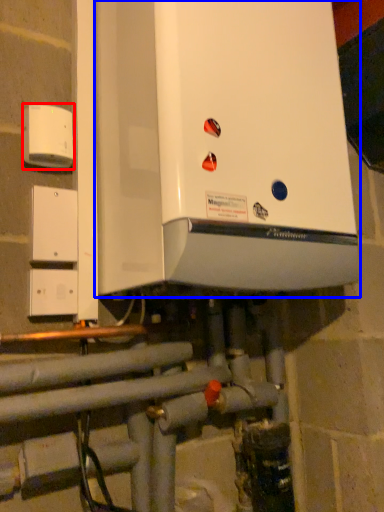
Question: Which object appears farthest to the camera in this image, electric outlet (highlighted by a red box) or home appliance (highlighted by a blue box)?

Choices:
 (A) electric outlet
 (B) home appliance

Answer: (A)